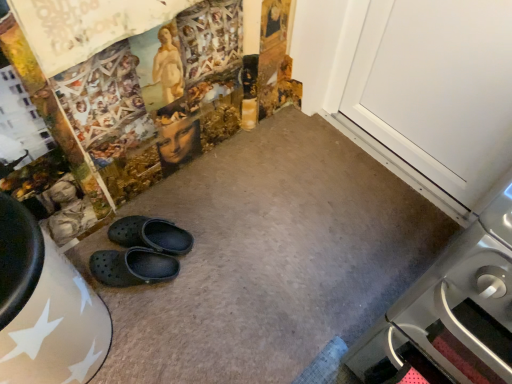
Question: From a real-world perspective, is black rubber clogs at center, placed as the 2th footwear when sorted from top to bottom, positioned under stainless steel oven at lower right based on gravity?

Choices:
 (A) yes
 (B) no

Answer: (A)

Question: Does black rubber clogs at center, the first footwear ordered from the bottom, lie in front of stainless steel oven at lower right?

Choices:
 (A) yes
 (B) no

Answer: (B)

Question: Can you see black rubber clogs at center, placed as the 2th footwear when sorted from top to bottom, touching stainless steel oven at lower right?

Choices:
 (A) yes
 (B) no

Answer: (B)

Question: Is the position of black rubber clogs at center, placed as the 2th footwear when sorted from top to bottom, more distant than that of stainless steel oven at lower right?

Choices:
 (A) no
 (B) yes

Answer: (B)

Question: From a real-world perspective, is black rubber clogs at center, the first footwear ordered from the bottom, positioned over stainless steel oven at lower right based on gravity?

Choices:
 (A) no
 (B) yes

Answer: (A)

Question: Is black rubber clogs at center, placed as the 2th footwear when sorted from top to bottom, not near stainless steel oven at lower right?

Choices:
 (A) yes
 (B) no

Answer: (B)

Question: Does black rubber clogs at lower left, marked as the 2th footwear in a bottom-to-top arrangement, turn towards white smooth door at upper right?

Choices:
 (A) yes
 (B) no

Answer: (B)

Question: Considering the relative sizes of black rubber clogs at lower left, which appears as the first footwear when viewed from the top, and white smooth door at upper right in the image provided, is black rubber clogs at lower left, which appears as the first footwear when viewed from the top, wider than white smooth door at upper right?

Choices:
 (A) yes
 (B) no

Answer: (A)

Question: From the image's perspective, does black rubber clogs at lower left, which appears as the first footwear when viewed from the top, appear lower than white smooth door at upper right?

Choices:
 (A) yes
 (B) no

Answer: (A)

Question: Can you confirm if black rubber clogs at lower left, marked as the 2th footwear in a bottom-to-top arrangement, is positioned to the left of white smooth door at upper right?

Choices:
 (A) yes
 (B) no

Answer: (A)

Question: Is black rubber clogs at lower left, which appears as the first footwear when viewed from the top, behind white smooth door at upper right?

Choices:
 (A) yes
 (B) no

Answer: (A)

Question: Considering the relative sizes of black rubber clogs at lower left, which appears as the first footwear when viewed from the top, and white smooth door at upper right in the image provided, is black rubber clogs at lower left, which appears as the first footwear when viewed from the top, bigger than white smooth door at upper right?

Choices:
 (A) yes
 (B) no

Answer: (B)

Question: Is white smooth door at upper right surrounded by stainless steel oven at lower right?

Choices:
 (A) yes
 (B) no

Answer: (B)